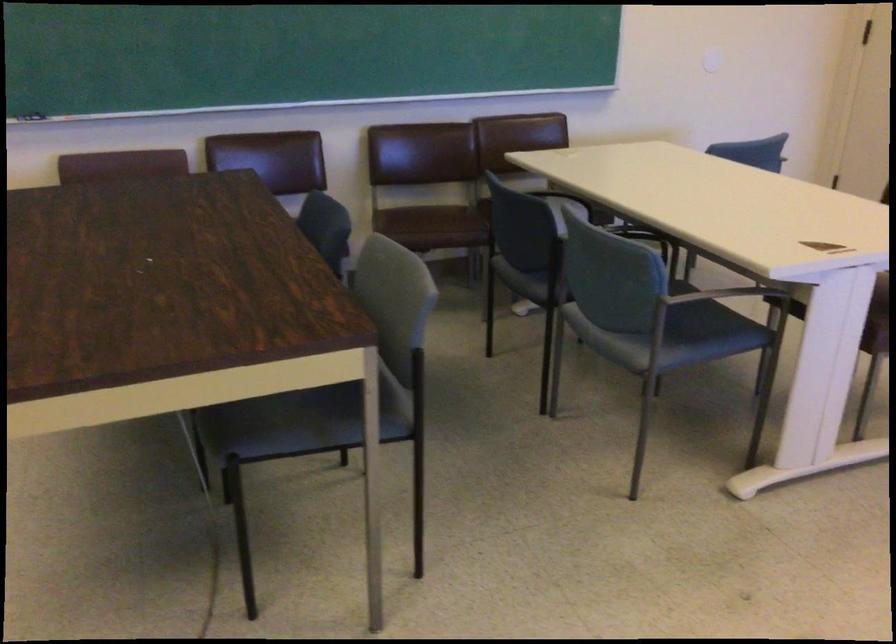
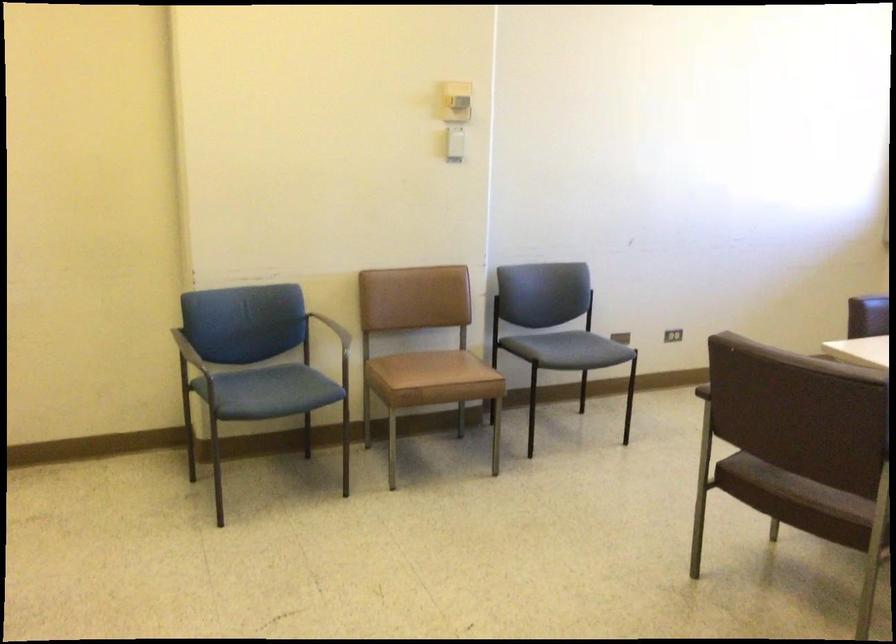
Question: The first image is from the beginning of the video and the second image is from the end. How did the camera likely rotate when shooting the video?

Choices:
 (A) Left
 (B) Right
 (C) Up
 (D) Down

Answer: (B)